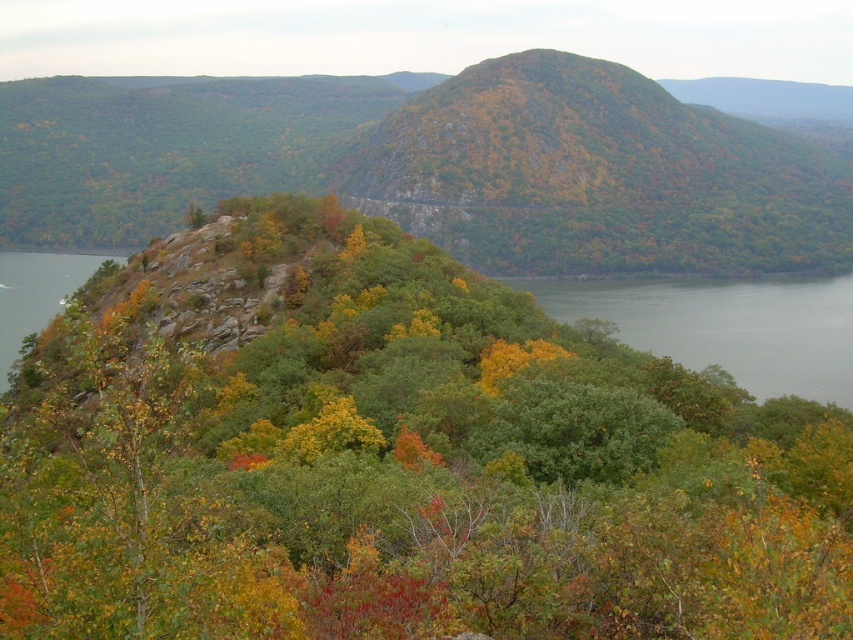
Can you confirm if green leafy tree at center is positioned below green rocky mountain at center?

Indeed, green leafy tree at center is positioned under green rocky mountain at center.

Which is below, green leafy tree at center or green rocky mountain at center?

Positioned lower is green leafy tree at center.

Locate an element on the screen. green leafy tree at center is located at coordinates (393, 458).

Is point (838, 289) farther from camera compared to point (3, 380)?

Yes, point (838, 289) is behind point (3, 380).

Image resolution: width=853 pixels, height=640 pixels. What do you see at coordinates (724, 324) in the screenshot?
I see `gray water at lower right` at bounding box center [724, 324].

The width and height of the screenshot is (853, 640). I want to click on gray water at lower right, so click(x=724, y=324).

Which is in front, point (761, 168) or point (654, 344)?

Point (654, 344)

Is green rocky mountain at center in front of gray water at lower right?

No, it is behind gray water at lower right.

Who is more forward, (202, 193) or (805, 388)?

Point (805, 388)

Image resolution: width=853 pixels, height=640 pixels. Identify the location of green rocky mountain at center. (433, 164).